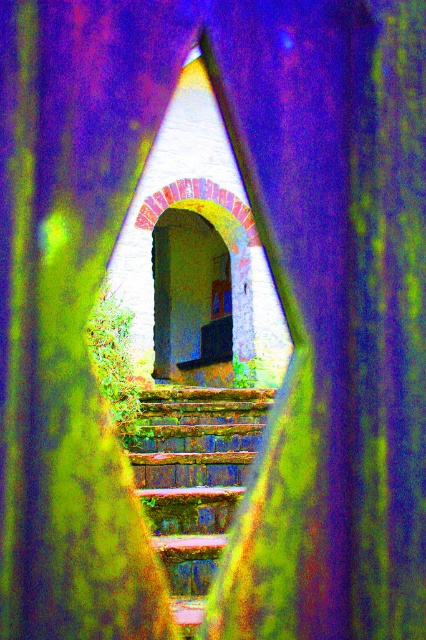
Question: Which point appears farthest from the camera in this image?

Choices:
 (A) (227, 349)
 (B) (176, 461)

Answer: (A)

Question: Is rusty metal stairs at center wider than matte wood balustrade at center?

Choices:
 (A) yes
 (B) no

Answer: (B)

Question: Does rusty metal stairs at center have a lesser width compared to matte wood balustrade at center?

Choices:
 (A) no
 (B) yes

Answer: (B)

Question: Which point is closer to the camera taking this photo?

Choices:
 (A) (204, 497)
 (B) (224, 356)

Answer: (A)

Question: Does rusty metal stairs at center appear on the left side of matte wood balustrade at center?

Choices:
 (A) yes
 (B) no

Answer: (A)